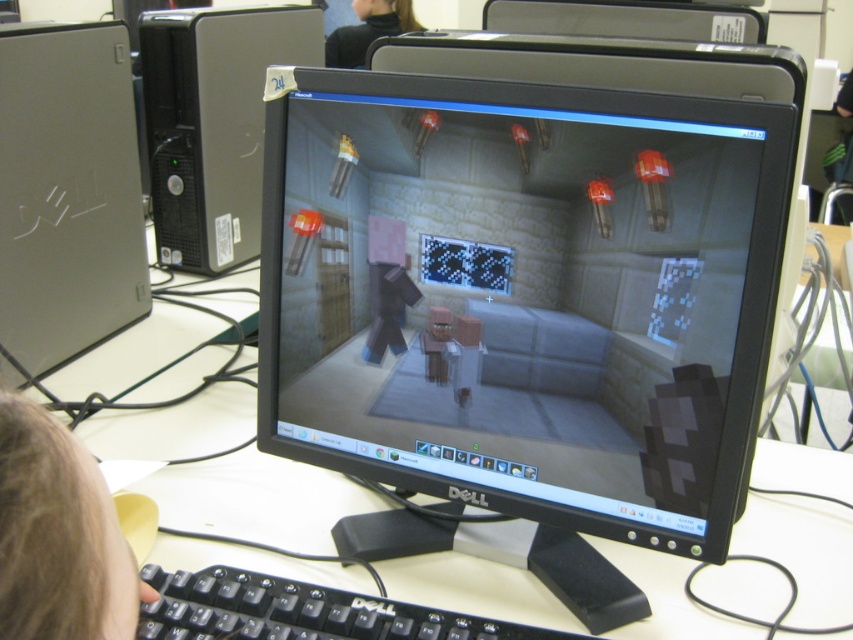
Which is behind, point (120, 292) or point (355, 636)?

The point (120, 292) is behind.

Which is behind, point (137, 193) or point (199, 580)?

The point (137, 193) is behind.

Where is `silver metallic computer tower at left`? The image size is (853, 640). silver metallic computer tower at left is located at coordinates (67, 192).

Which is above, brown hair at lower left or black plastic monitor at upper center?

Positioned higher is black plastic monitor at upper center.

Does brown hair at lower left have a greater width compared to black plastic monitor at upper center?

No.

Is point (15, 611) positioned in front of point (584, 35)?

That is True.

You are a GUI agent. You are given a task and a screenshot of the screen. Output one action in this format:
    pyautogui.click(x=<x>, y=<y>)
    Task: Click on the brown hair at lower left
    The height and width of the screenshot is (640, 853).
    Given the screenshot: What is the action you would take?
    [x=59, y=536]

Does black plastic desktop tower at left come in front of brown hair at lower left?

No, it is not.

Is black plastic desktop tower at left smaller than brown hair at lower left?

No.

Who is more distant from viewer, (299, 45) or (51, 467)?

Positioned behind is point (299, 45).

Identify the location of black plastic desktop tower at left. This screenshot has height=640, width=853. (212, 124).